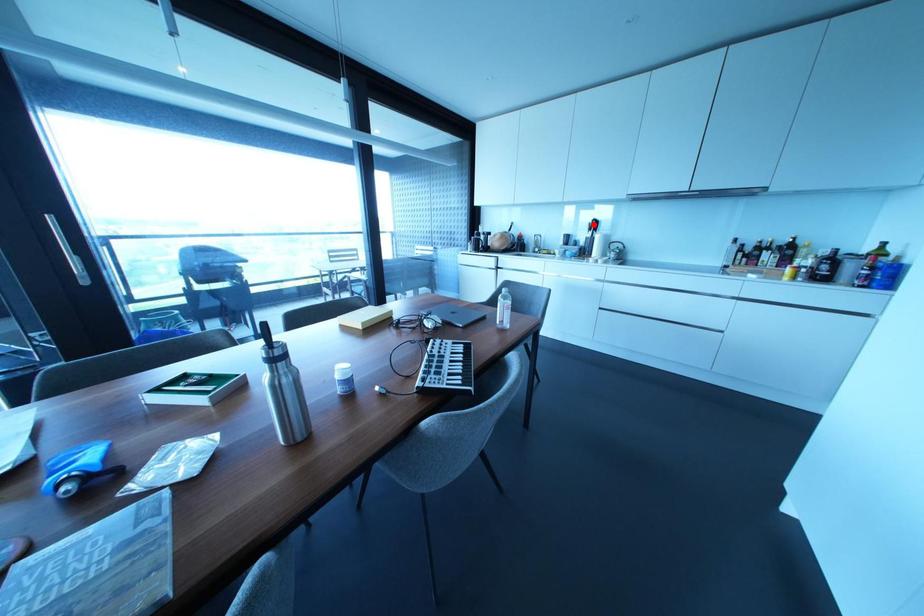
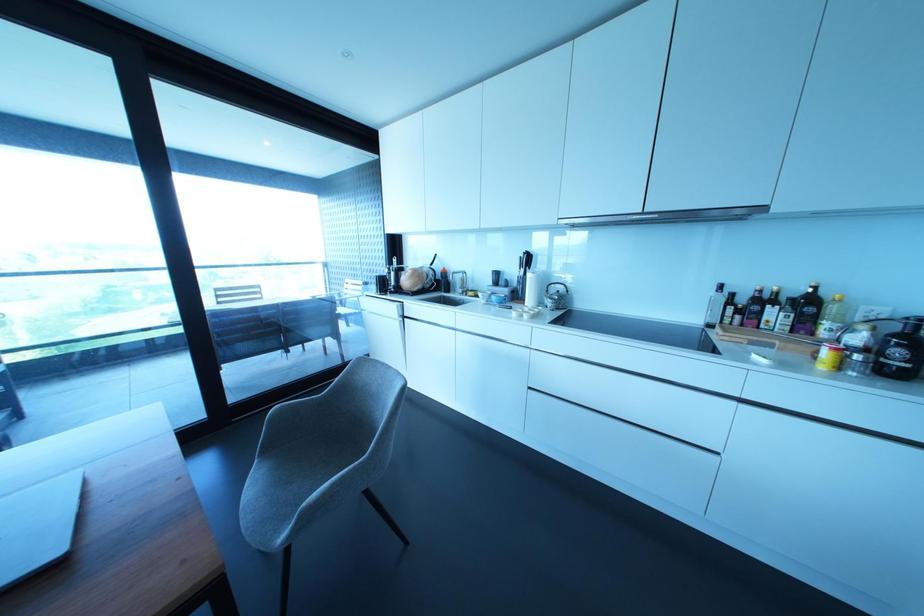
Where in the second image is the point corresponding to the highlighted location from the first image?

(527, 259)